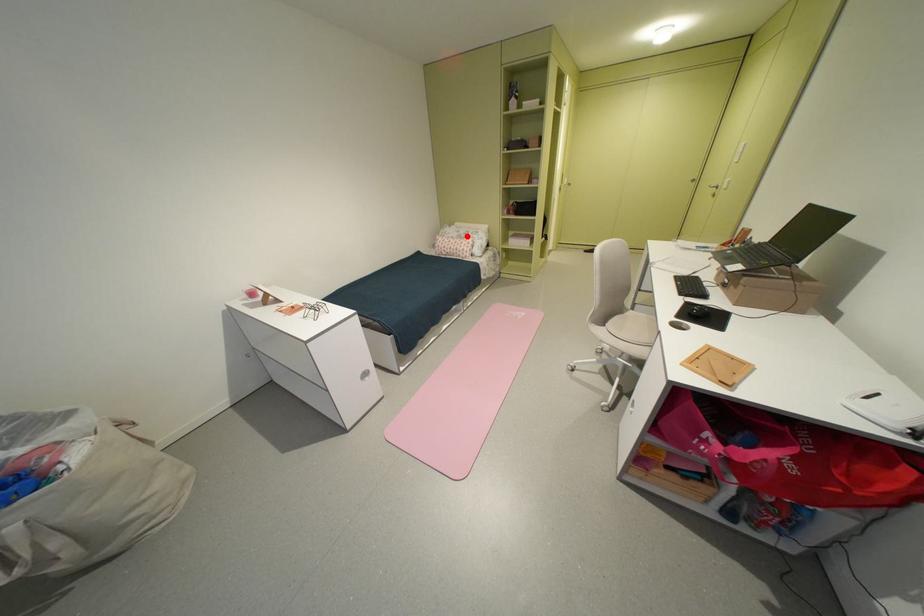
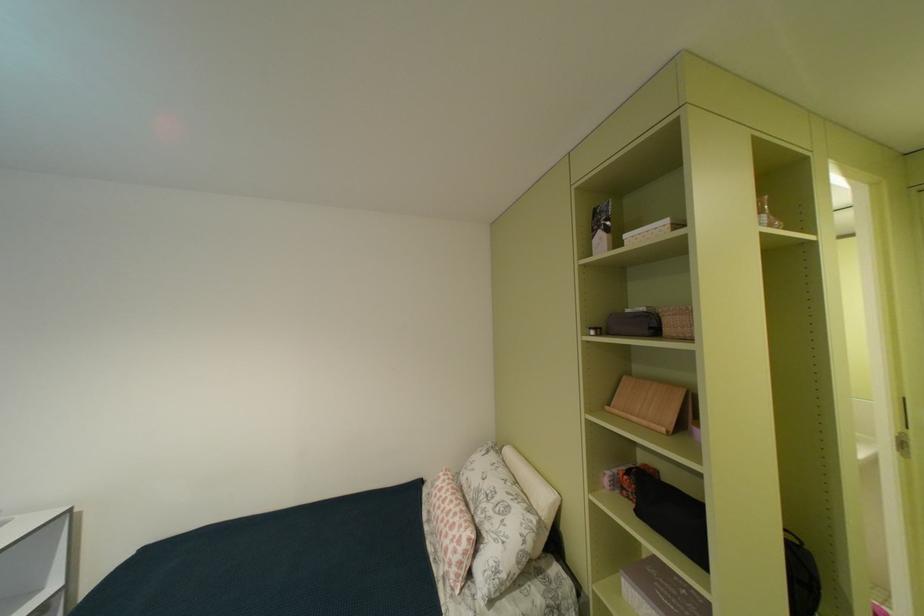
Question: A red point is marked in image1. In image2, is the corresponding 3D point closer to the camera or farther? Reply with the corresponding letter.

Choices:
 (A) The corresponding 3D point is closer.
 (B) The corresponding 3D point is farther.

Answer: (B)